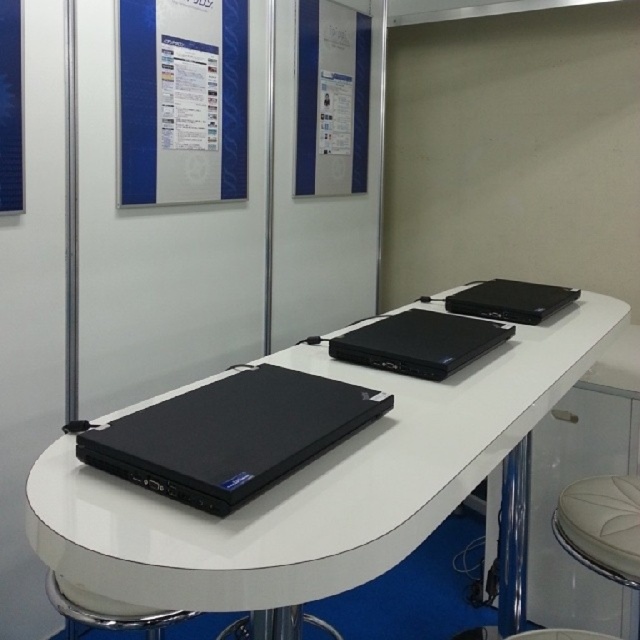
Question: Is white leather bar stool at lower right wider than black matte laptop at upper right?

Choices:
 (A) no
 (B) yes

Answer: (A)

Question: Based on their relative distances, which object is nearer to the blue glossy poster at upper left?

Choices:
 (A) black glossy laptop at center
 (B) black matte laptop at center
 (C) matte plastic poster at upper center
 (D) matte black laptop at center

Answer: (C)

Question: Which object is farther from the camera taking this photo?

Choices:
 (A) white leather bar stool at lower right
 (B) black glossy laptop at center
 (C) black matte laptop at center
 (D) blue glossy poster at upper left

Answer: (D)

Question: Does matte black laptop at center appear under black matte laptop at upper right?

Choices:
 (A) no
 (B) yes

Answer: (B)

Question: Is matte plastic poster at upper center bigger than white leather bar stool at lower right?

Choices:
 (A) no
 (B) yes

Answer: (B)

Question: Which object appears farthest from the camera in this image?

Choices:
 (A) black matte laptop at center
 (B) black glossy laptop at center
 (C) matte plastic poster at upper center
 (D) white leather bar stool at lower left

Answer: (C)